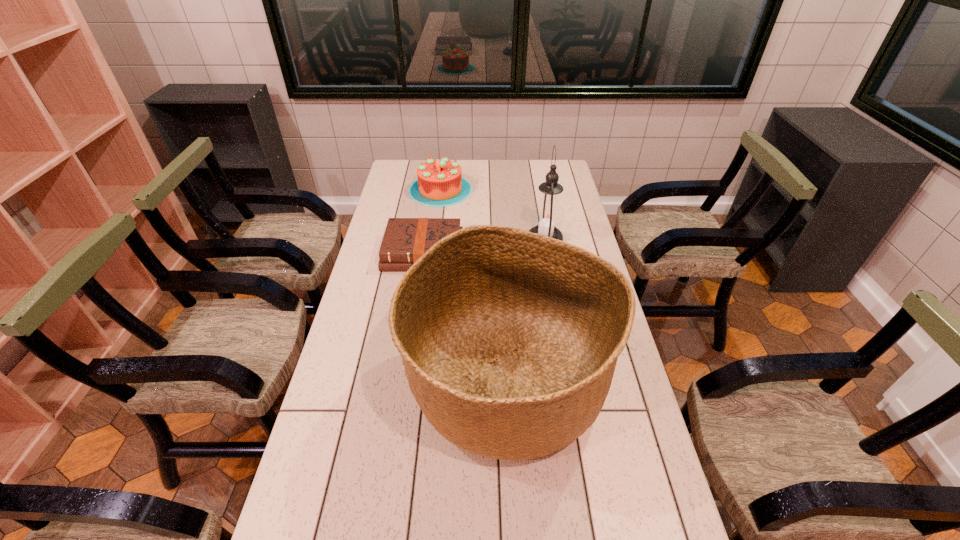
I want to click on cake that is at the left edge, so click(x=440, y=183).

Where is `hardback book that is at the left edge`? Image resolution: width=960 pixels, height=540 pixels. hardback book that is at the left edge is located at coordinates (405, 240).

Where is `oil lamp that is at the right edge`? The height and width of the screenshot is (540, 960). oil lamp that is at the right edge is located at coordinates (547, 216).

You are a GUI agent. You are given a task and a screenshot of the screen. Output one action in this format:
    pyautogui.click(x=<x>, y=<y>)
    Task: Click on the basket present at the right edge
    This screenshot has width=960, height=540.
    Given the screenshot: What is the action you would take?
    [510, 339]

At what (x,y) coordinates should I click in order to perform the action: click on object situated at the far left corner. Please return your answer as a coordinate pair (x, y). The width and height of the screenshot is (960, 540). Looking at the image, I should click on (440, 183).

The width and height of the screenshot is (960, 540). Find the location of `vacant space at the far edge of the desktop`. vacant space at the far edge of the desktop is located at coordinates (500, 161).

In the image, there is a desktop. At what (x,y) coordinates should I click in order to perform the action: click on vacant space at the left edge. Please return your answer as a coordinate pair (x, y). Looking at the image, I should click on (x=363, y=307).

This screenshot has width=960, height=540. Find the location of `vacant space at the right edge`. vacant space at the right edge is located at coordinates (588, 240).

You are a GUI agent. You are given a task and a screenshot of the screen. Output one action in this format:
    pyautogui.click(x=<x>, y=<y>)
    Task: Click on the object that stands as the closest to the basket
    
    Given the screenshot: What is the action you would take?
    pyautogui.click(x=405, y=240)

Select which object appears as the second closest to the cake. Please provide its 2D coordinates. Your answer should be formatted as a tuple, i.e. [(x, y)], where the tuple contains the x and y coordinates of a point satisfying the conditions above.

[(547, 216)]